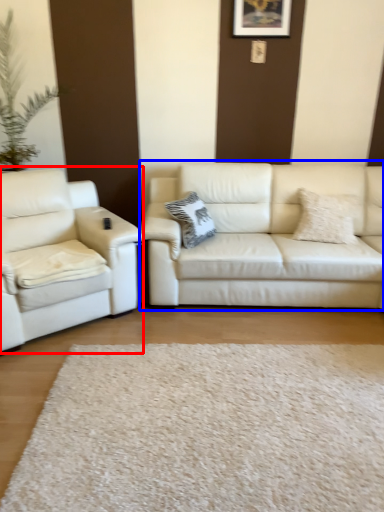
Question: Which object appears closest to the camera in this image, studio couch (highlighted by a red box) or studio couch (highlighted by a blue box)?

Choices:
 (A) studio couch
 (B) studio couch

Answer: (A)